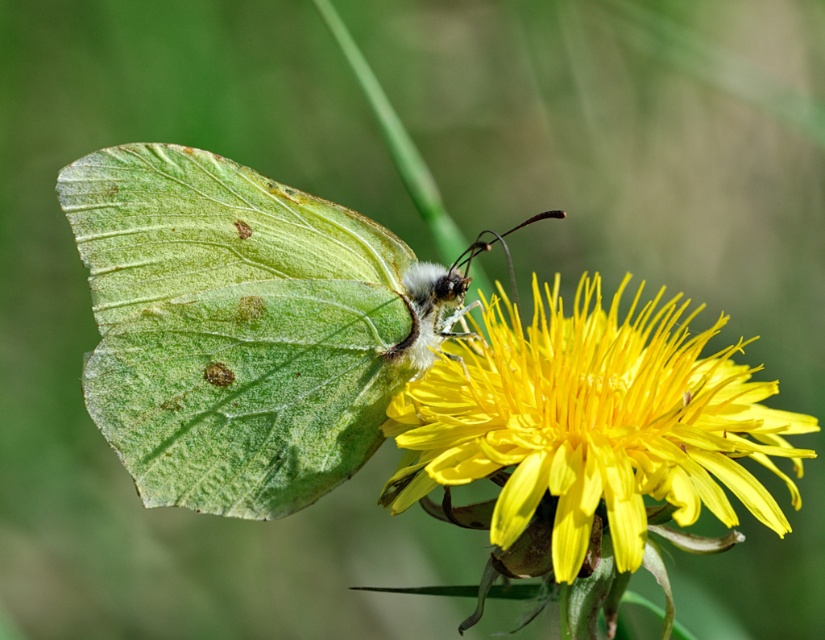
You are an entomologist observing the green matte butterfly at center and the yellow matte flower at center. Which object is taller?

The green matte butterfly at center is taller than the yellow matte flower at center.

You are a botanist studying the dandelion flower in the image. You notice a point marked at coordinates (234, 328). What is located at this point?

The point at coordinates (234, 328) marks the green matte butterfly at center.